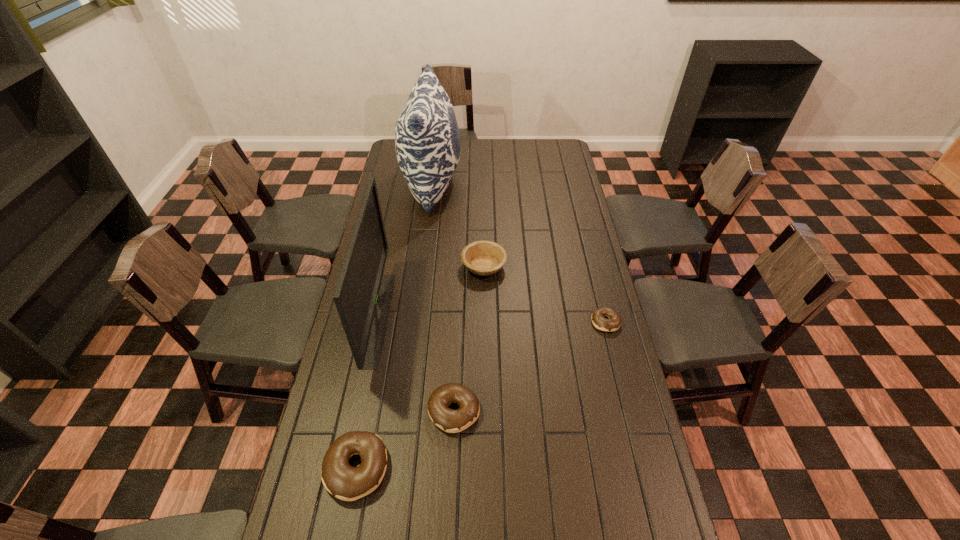
Where is `free spot between the farthest object and the leftmost doughnut`? free spot between the farthest object and the leftmost doughnut is located at coordinates (395, 326).

This screenshot has height=540, width=960. I want to click on free space between the cushion and the bowl, so click(458, 225).

Locate an element on the screen. The image size is (960, 540). free spot between the second farthest doughnut and the nearest doughnut is located at coordinates (405, 440).

You are a GUI agent. You are given a task and a screenshot of the screen. Output one action in this format:
    pyautogui.click(x=<x>, y=<y>)
    Task: Click on the free space between the shortest object and the bowl
    
    Given the screenshot: What is the action you would take?
    tap(544, 294)

Locate an element on the screen. This screenshot has width=960, height=540. free spot between the cushion and the farthest doughnut is located at coordinates (519, 253).

The image size is (960, 540). In order to click on vacant space that is in between the bowl and the shortest doughnut in this screenshot , I will do `click(544, 294)`.

Locate an element on the screen. The image size is (960, 540). free point between the bowl and the second farthest doughnut is located at coordinates (468, 339).

Where is `object that is the nearest to the leftmost doughnut`? This screenshot has height=540, width=960. object that is the nearest to the leftmost doughnut is located at coordinates (452, 421).

Locate an element on the screen. This screenshot has width=960, height=540. the third closest object to the second tallest doughnut is located at coordinates (599, 321).

Select which doughnut is the second closest to the second nearest object. Please provide its 2D coordinates. Your answer should be formatted as a tuple, i.e. [(x, y)], where the tuple contains the x and y coordinates of a point satisfying the conditions above.

[(599, 321)]